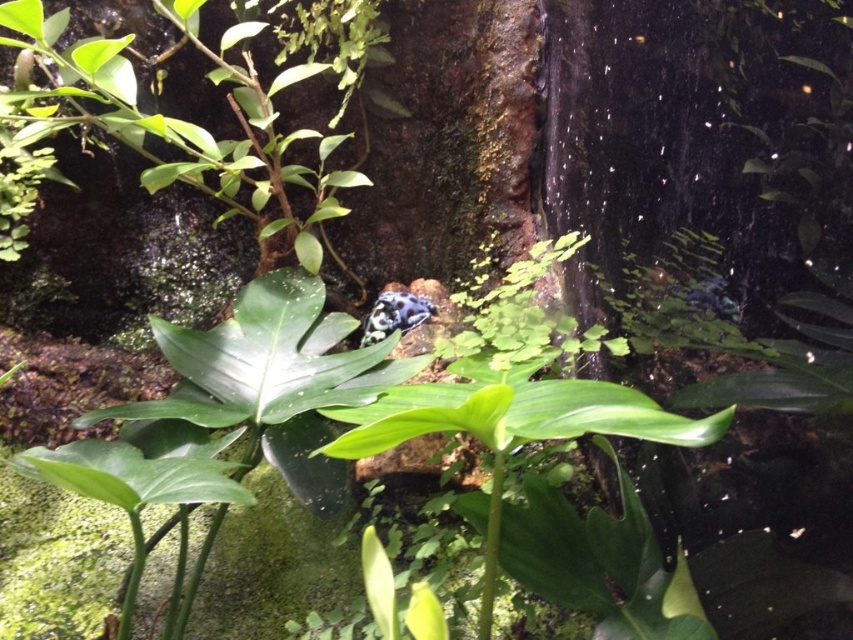
You are observing a tropical terrarium and notice two points marked in the scene. From your perspective, which point is closer to you, point [207,490] or point [338,448]?

Point [338,448] is closer to you because point [207,490] is behind it.